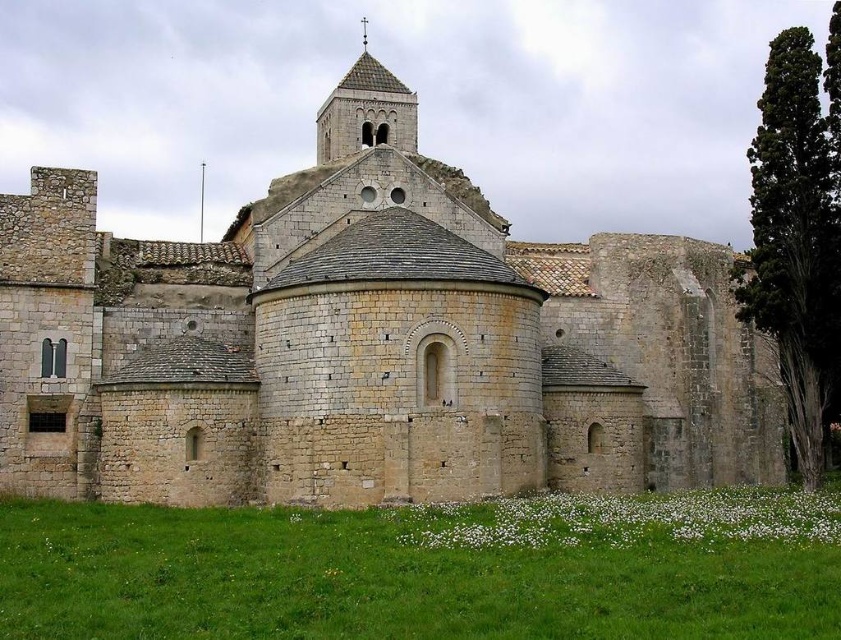
Does stone castle at center come in front of smooth stone tower at upper center?

Yes.

Is stone castle at center shorter than smooth stone tower at upper center?

Indeed, stone castle at center has a lesser height compared to smooth stone tower at upper center.

Who is more distant from viewer, (378,268) or (331,160)?

Positioned behind is point (331,160).

Image resolution: width=841 pixels, height=640 pixels. Find the location of `stone castle at center`. stone castle at center is located at coordinates (368, 352).